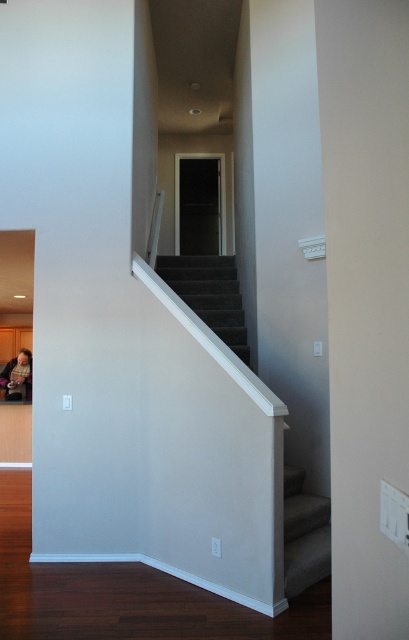
You are standing at the bottom of the dark gray carpeted stairs at center. You need to plug in an appliance that requires an outlet. Where should you look for the outlet?

The white electrical outlet is on the right side of the image, so you should look to your right to find it.